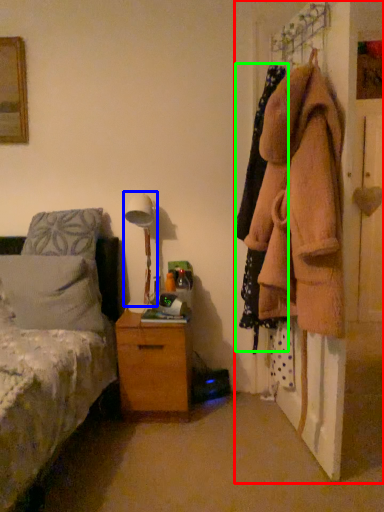
Question: Based on their relative distances, which object is farther from closet (highlighted by a red box)? Choose from bedside lamp (highlighted by a blue box) and clothing (highlighted by a green box).

Choices:
 (A) bedside lamp
 (B) clothing

Answer: (A)